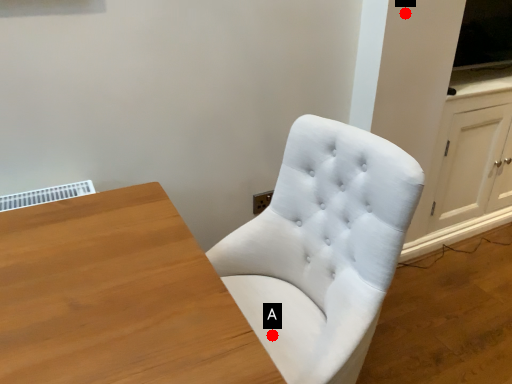
Question: Two points are circled on the image, labeled by A and B beside each circle. Which point is farther from the camera taking this photo?

Choices:
 (A) A is further
 (B) B is further

Answer: (B)